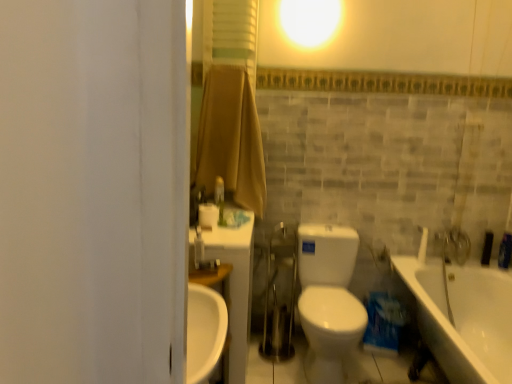
Question: From a real-world perspective, is white matte toilet paper at center above or below white glossy faucet at upper right?

Choices:
 (A) below
 (B) above

Answer: (B)

Question: In the image, is white matte toilet paper at center positioned in front of or behind white glossy faucet at upper right?

Choices:
 (A) behind
 (B) front

Answer: (B)

Question: Which is nearer to the white glossy toilet at center?

Choices:
 (A) white glossy faucet at upper right
 (B) brown fabric shower curtain at upper center
 (C) white matte toilet paper at center
 (D) white glossy bathtub at lower right
 (E) white plastic faucet at upper left

Answer: (D)

Question: Which is farther from the white glossy bathtub at lower right?

Choices:
 (A) white matte toilet paper at center
 (B) brown fabric shower curtain at upper center
 (C) white glossy faucet at upper right
 (D) white plastic faucet at upper left
 (E) white glossy toilet at center

Answer: (D)